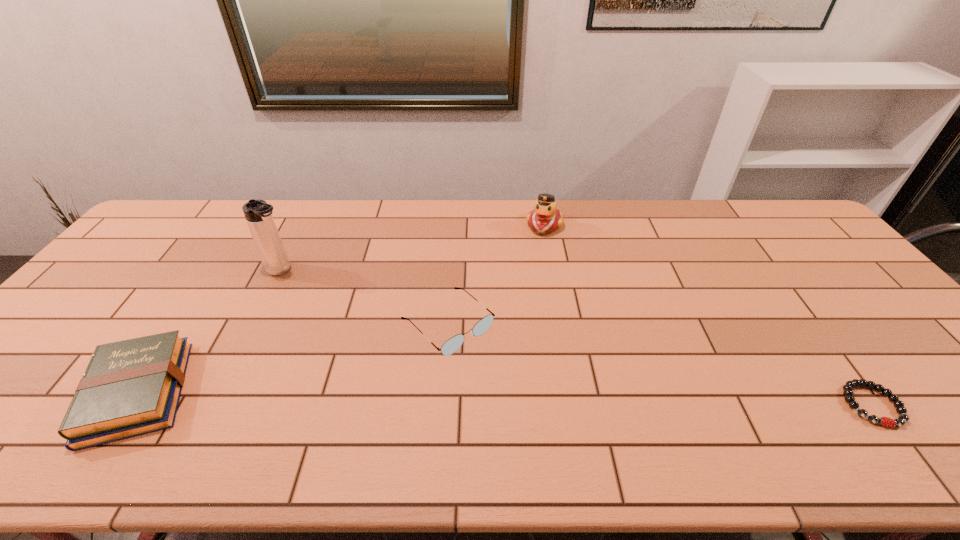
In order to click on vacant position in the image that satisfies the following two spatial constraints: 1. on the back side of the second object from right to left; 2. on the left side of the leftmost object in this screenshot , I will do `click(250, 226)`.

Find the location of a particular element. The height and width of the screenshot is (540, 960). vacant space that satisfies the following two spatial constraints: 1. on the front side of the book; 2. on the right side of the shortest object is located at coordinates click(x=130, y=405).